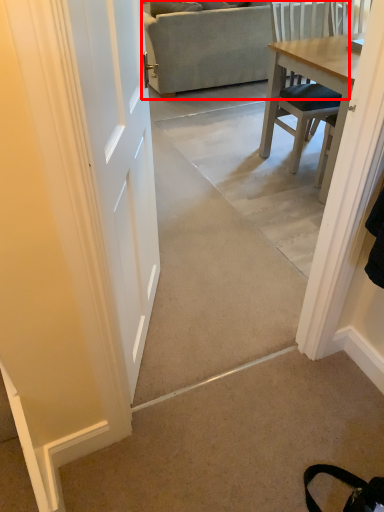
Question: From the image's perspective, what is the correct spatial positioning of studio couch (annotated by the red box) in reference to concrete?

Choices:
 (A) below
 (B) above

Answer: (B)